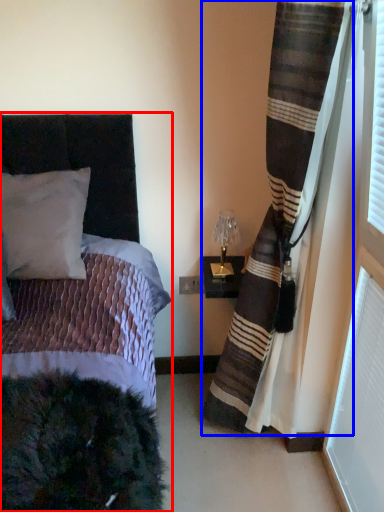
Question: Which object appears closest to the camera in this image, bed (highlighted by a red box) or curtain (highlighted by a blue box)?

Choices:
 (A) bed
 (B) curtain

Answer: (A)